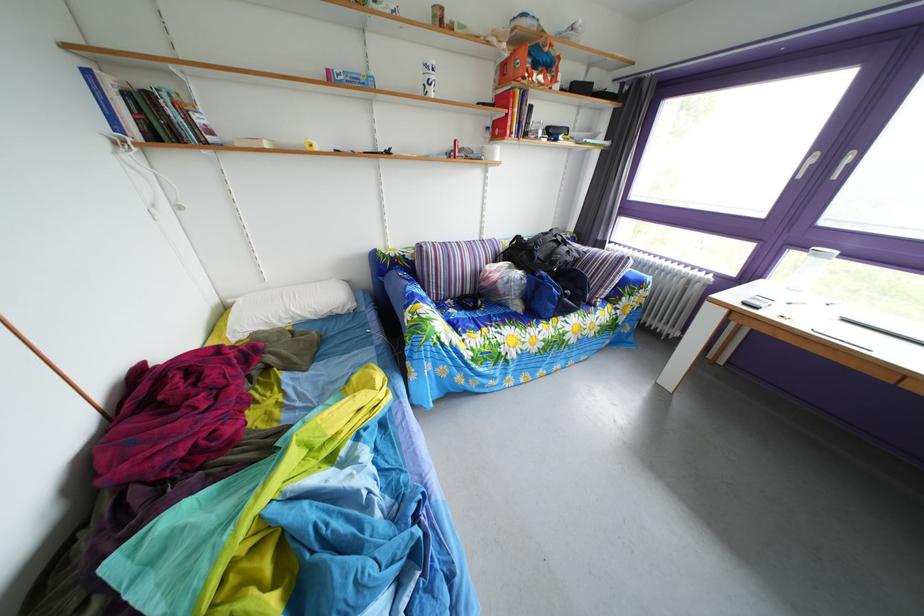
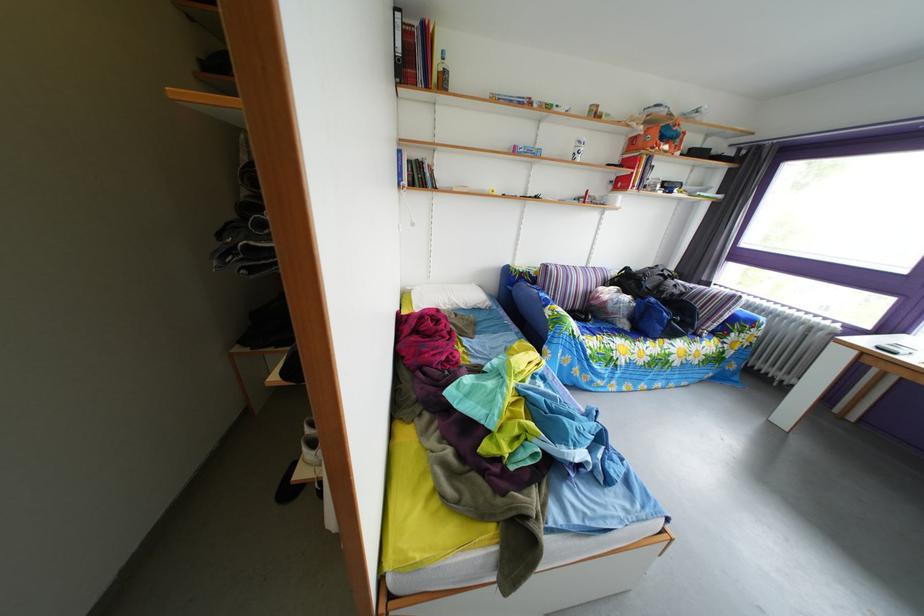
The point at (343, 307) is marked in the first image. Where is the corresponding point in the second image?

(485, 305)